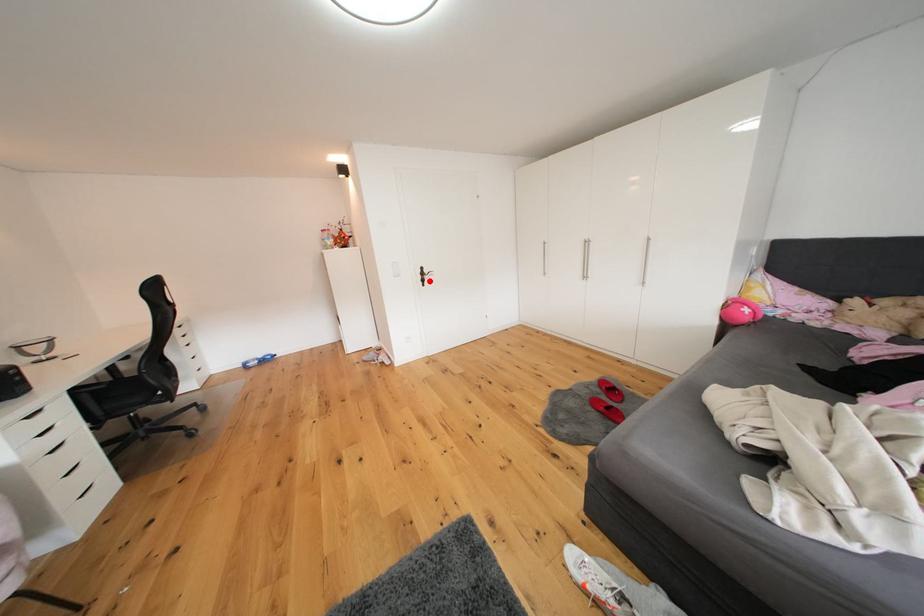
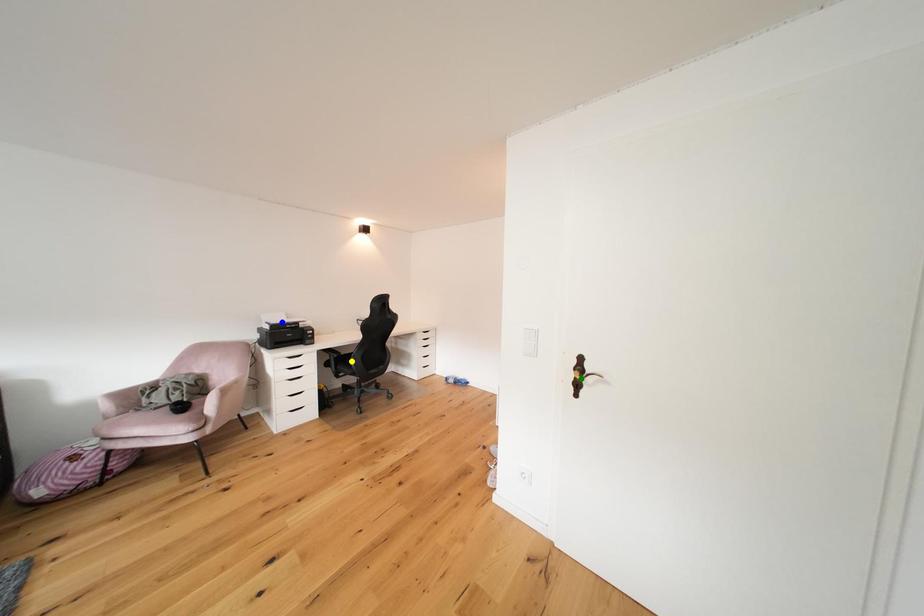
Question: I am providing you with two images of the same scene from different viewpoints. A red point is marked on the first image. You are given multiple points on the second image. Which spot in image 2 lines up with the point in image 1?

Choices:
 (A) yellow point
 (B) blue point
 (C) green point

Answer: (C)